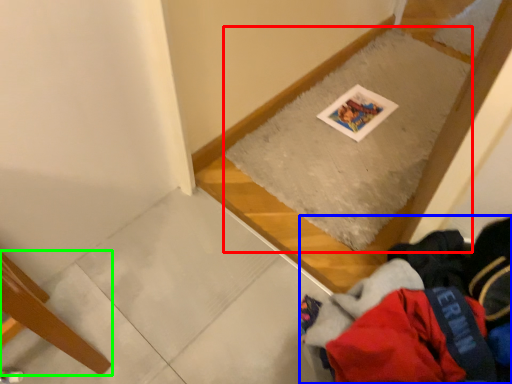
Question: Based on their relative distances, which object is farther from mat (highlighted by a red box)? Choose from clothing (highlighted by a blue box) and furniture (highlighted by a green box).

Choices:
 (A) clothing
 (B) furniture

Answer: (B)